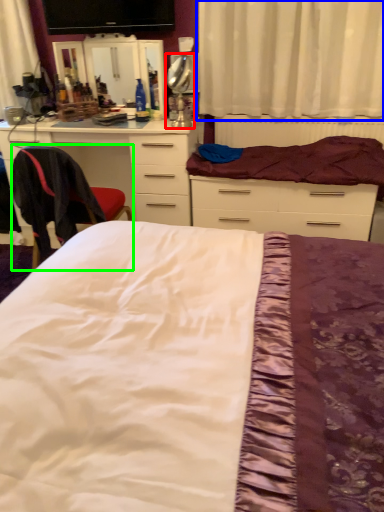
Question: Estimate the real-world distances between objects in this image. Which object is closer to table lamp (highlighted by a red box), curtain (highlighted by a blue box) or chair (highlighted by a green box)?

Choices:
 (A) curtain
 (B) chair

Answer: (A)